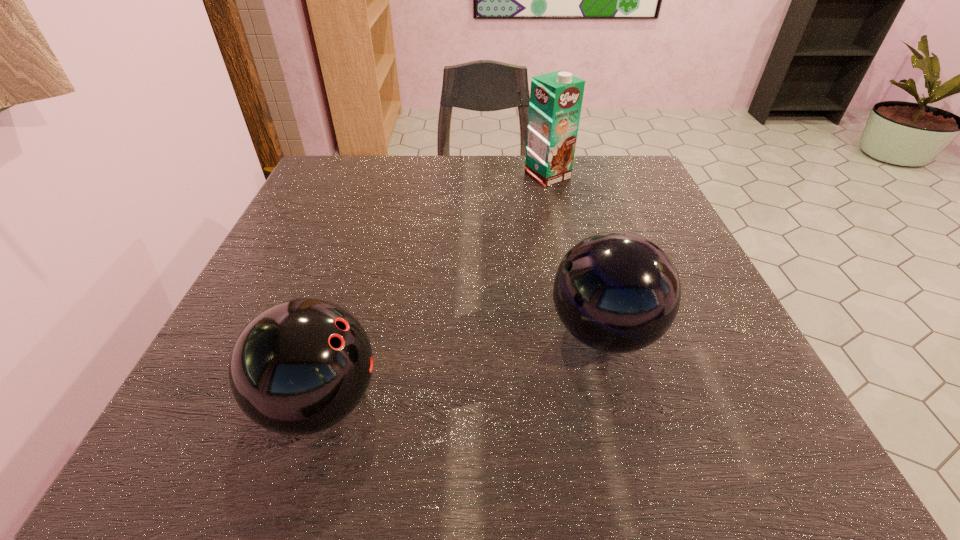
Find the location of a particular element. Image resolution: width=960 pixels, height=540 pixels. object situated at the near edge is located at coordinates (301, 366).

The image size is (960, 540). What are the coordinates of `object at the left edge` in the screenshot? It's located at (301, 366).

Where is `object at the right edge`? The width and height of the screenshot is (960, 540). object at the right edge is located at coordinates (617, 292).

Identify the location of object situated at the near left corner. (301, 366).

Find the location of `vacant space at the far edge of the desktop`. vacant space at the far edge of the desktop is located at coordinates (457, 191).

You are a GUI agent. You are given a task and a screenshot of the screen. Output one action in this format:
    pyautogui.click(x=<x>, y=<y>)
    Task: Click on the vacant area at the near edge
    
    Given the screenshot: What is the action you would take?
    pyautogui.click(x=539, y=448)

Where is `blank space at the right edge`? This screenshot has width=960, height=540. blank space at the right edge is located at coordinates (688, 401).

In the image, there is a desktop. Where is `vacant space at the far left corner`? vacant space at the far left corner is located at coordinates (344, 200).

Where is `vacant space at the near right corner`? The height and width of the screenshot is (540, 960). vacant space at the near right corner is located at coordinates (748, 428).

Identify the location of free point between the leftmost object and the carton. This screenshot has width=960, height=540. (434, 289).